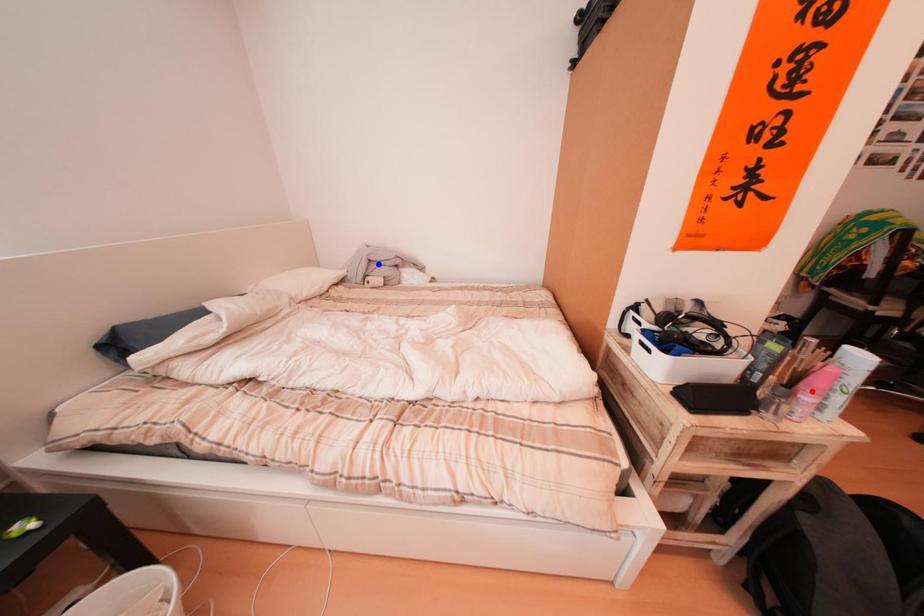
Question: Which of the two points in the image is closer to the camera?

Choices:
 (A) Blue point is closer.
 (B) Red point is closer.

Answer: (B)